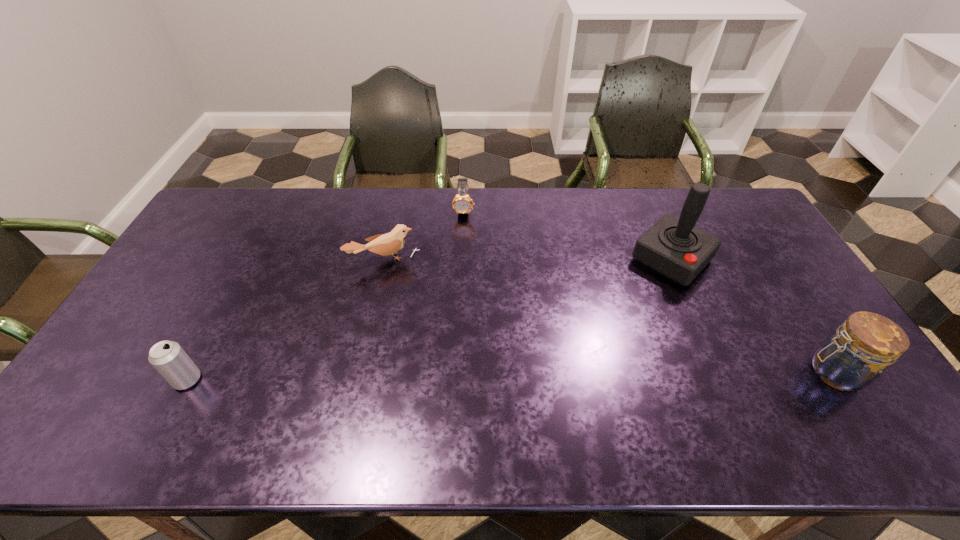
I want to click on the leftmost object, so click(167, 357).

At what (x,y) coordinates should I click in order to perform the action: click on the rightmost object. Please return your answer as a coordinate pair (x, y). Image resolution: width=960 pixels, height=540 pixels. Looking at the image, I should click on (852, 358).

This screenshot has height=540, width=960. Identify the location of the second tallest object. [x=852, y=358].

This screenshot has width=960, height=540. In order to click on bird in this screenshot , I will do `click(387, 244)`.

Locate an element on the screen. the tallest object is located at coordinates (673, 247).

What are the coordinates of `joystick` in the screenshot? It's located at (673, 247).

The height and width of the screenshot is (540, 960). What are the coordinates of `the third object from right to left` in the screenshot? It's located at (x=462, y=203).

Where is `the farthest object`? This screenshot has height=540, width=960. the farthest object is located at coordinates (462, 203).

Find the location of a particular element. free spot located on the back of the leftmost object is located at coordinates (241, 276).

At what (x,y) coordinates should I click in order to perform the action: click on vacant space located 0.240m on the lid of the jar. Please return your answer as a coordinate pair (x, y). Looking at the image, I should click on (711, 373).